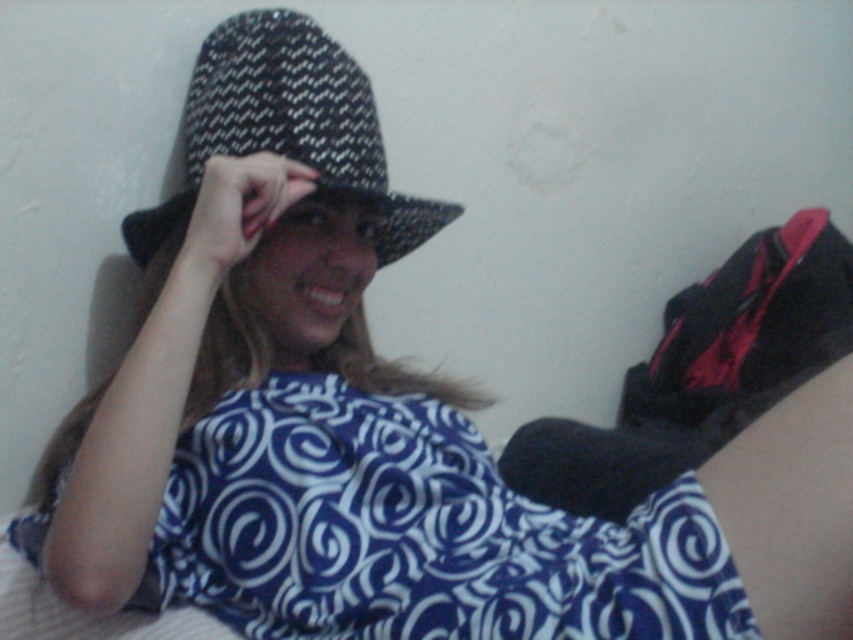
Can you confirm if blue printed fabric dress at center is thinner than black woven fedora at upper center?

Incorrect, blue printed fabric dress at center's width is not less than black woven fedora at upper center's.

Between blue printed fabric dress at center and black woven fedora at upper center, which one is positioned lower?

blue printed fabric dress at center is lower down.

Is point (199, 529) positioned after point (289, 45)?

No, it is not.

Where is `blue printed fabric dress at center`? This screenshot has height=640, width=853. blue printed fabric dress at center is located at coordinates (413, 532).